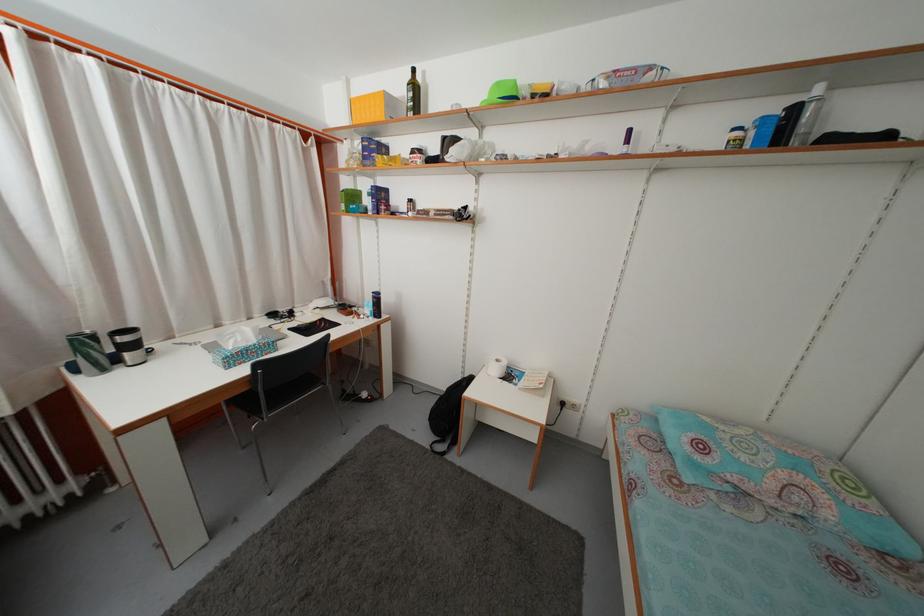
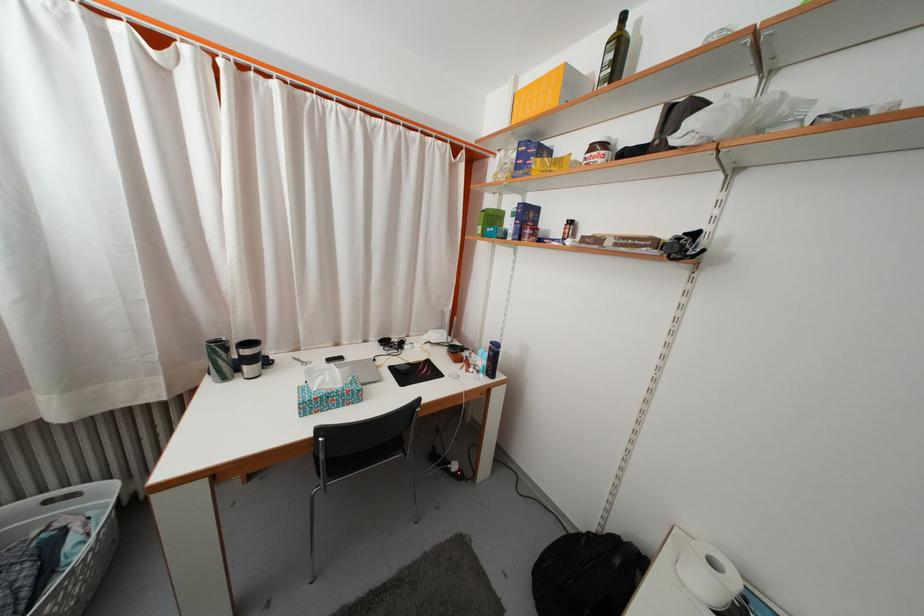
The point at (299, 331) is marked in the first image. Where is the corresponding point in the second image?

(402, 369)